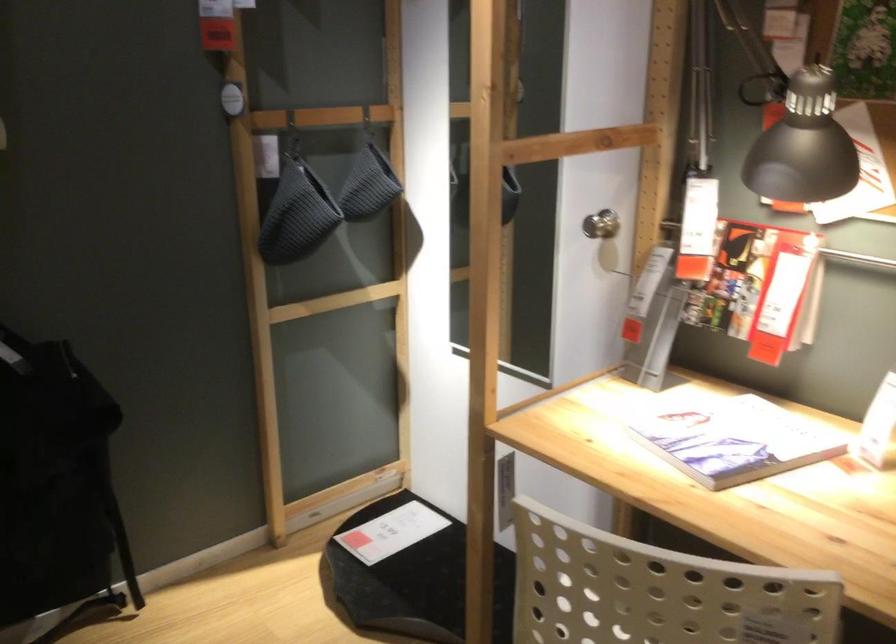
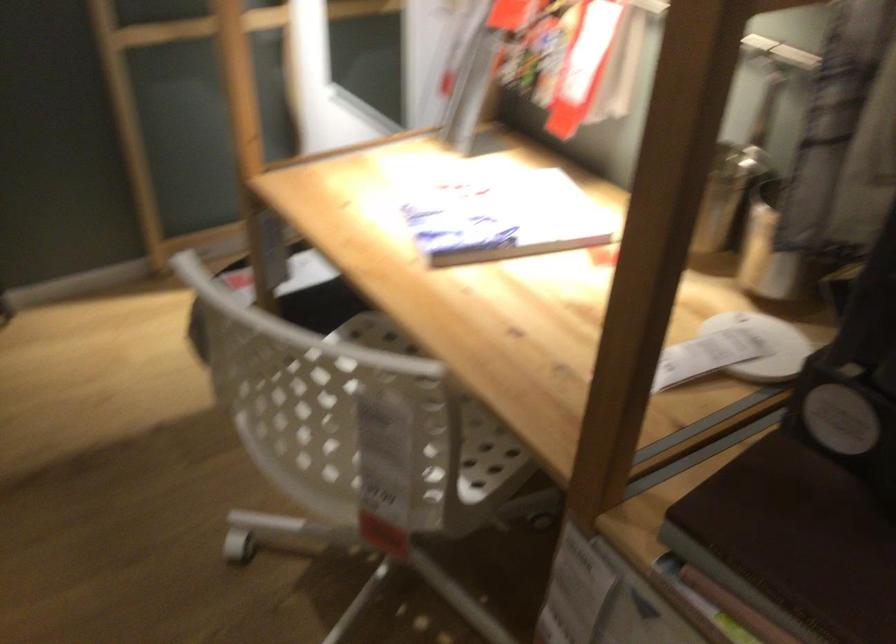
Question: The images are taken continuously from a first-person perspective. In which direction are you moving?

Choices:
 (A) Left
 (B) Right
 (C) Forward
 (D) Backward

Answer: (B)